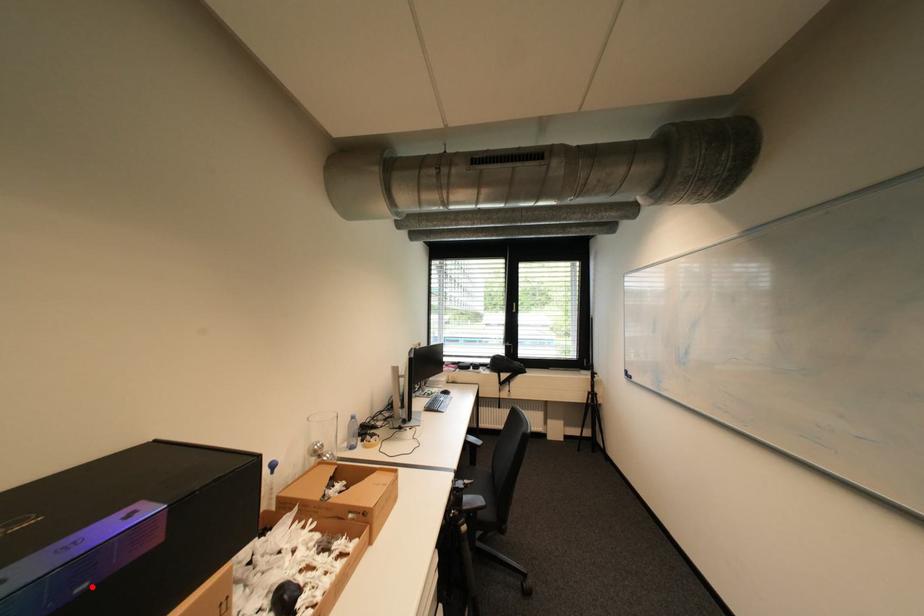
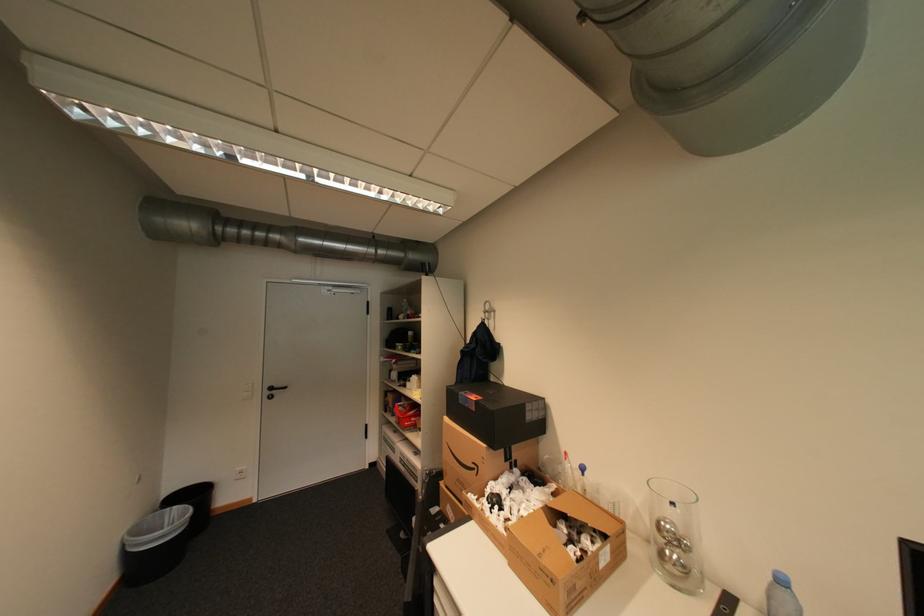
Locate, in the second image, the point that corresponds to the highlighted location in the first image.

(476, 406)